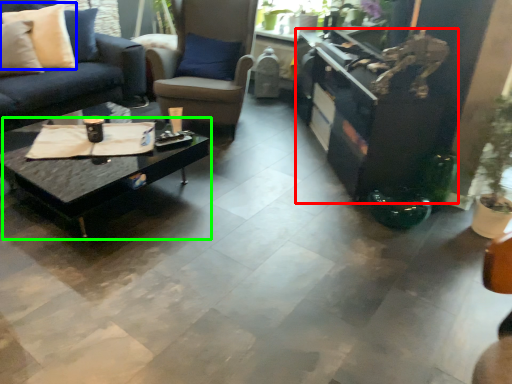
Question: Considering the real-world distances, which object is closest to entertainment center (highlighted by a red box)? pillow (highlighted by a blue box) or coffee table (highlighted by a green box).

Choices:
 (A) pillow
 (B) coffee table

Answer: (B)